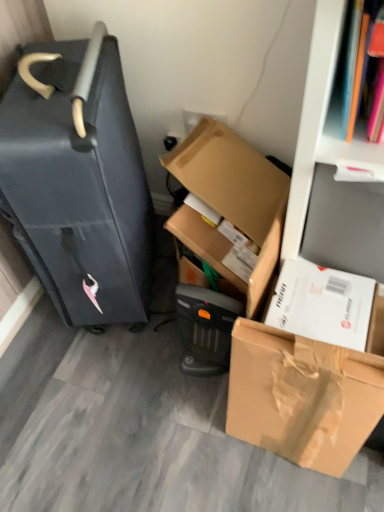
Question: From the image's perspective, does white cardboard bookshelf at upper right appear lower than cardboard box at center, which is the first box in top-to-bottom order?

Choices:
 (A) no
 (B) yes

Answer: (A)

Question: Is white cardboard bookshelf at upper right facing towards cardboard box at center, which is the first box in top-to-bottom order?

Choices:
 (A) yes
 (B) no

Answer: (B)

Question: Does white cardboard bookshelf at upper right have a larger size compared to cardboard box at center, which ranks as the 2th box in bottom-to-top order?

Choices:
 (A) yes
 (B) no

Answer: (A)

Question: Is the position of white cardboard bookshelf at upper right more distant than that of cardboard box at center, which is the first box in top-to-bottom order?

Choices:
 (A) no
 (B) yes

Answer: (A)

Question: Does white cardboard bookshelf at upper right appear on the right side of cardboard box at center, which ranks as the 2th box in bottom-to-top order?

Choices:
 (A) yes
 (B) no

Answer: (A)

Question: Is white cardboard bookshelf at upper right shorter than cardboard box at center, which ranks as the 2th box in bottom-to-top order?

Choices:
 (A) yes
 (B) no

Answer: (B)

Question: Is cardboard box at center, which is the first box in top-to-bottom order, completely or partially outside of matte black suitcase at left?

Choices:
 (A) no
 (B) yes

Answer: (B)

Question: Is the position of cardboard box at center, which is the first box in top-to-bottom order, more distant than that of matte black suitcase at left?

Choices:
 (A) no
 (B) yes

Answer: (B)

Question: Is cardboard box at center, which is the first box in top-to-bottom order, at the left side of matte black suitcase at left?

Choices:
 (A) no
 (B) yes

Answer: (A)

Question: Considering the relative sizes of cardboard box at center, which ranks as the 2th box in bottom-to-top order, and matte black suitcase at left in the image provided, is cardboard box at center, which ranks as the 2th box in bottom-to-top order, shorter than matte black suitcase at left?

Choices:
 (A) yes
 (B) no

Answer: (A)

Question: From a real-world perspective, is cardboard box at center, which ranks as the 2th box in bottom-to-top order, positioned under matte black suitcase at left based on gravity?

Choices:
 (A) no
 (B) yes

Answer: (B)

Question: Can you confirm if cardboard box at center, which ranks as the 2th box in bottom-to-top order, is bigger than matte black suitcase at left?

Choices:
 (A) yes
 (B) no

Answer: (B)

Question: Can you see brown cardboard box at lower right, which is the first box in bottom-to-top order, touching matte black suitcase at left?

Choices:
 (A) no
 (B) yes

Answer: (A)